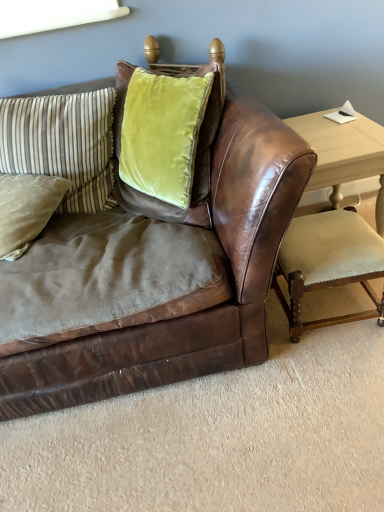
Question: Would you say velvet beige armchair at lower right is inside or outside light wood table at right?

Choices:
 (A) inside
 (B) outside

Answer: (B)

Question: Is velvet beige armchair at lower right bigger or smaller than light wood table at right?

Choices:
 (A) big
 (B) small

Answer: (B)

Question: Which of these objects is positioned farthest from the velvet green pillow at upper left, the first pillow when ordered from top to bottom?

Choices:
 (A) light wood table at right
 (B) brown leather couch at center
 (C) suede green pillow at left, which is counted as the 2th pillow, starting from the top
 (D) velvet beige armchair at lower right

Answer: (A)

Question: Based on their relative distances, which object is farther from the light wood table at right?

Choices:
 (A) suede green pillow at left, acting as the first pillow starting from the bottom
 (B) velvet beige armchair at lower right
 (C) velvet green pillow at upper left, the 2th pillow from the bottom
 (D) brown leather couch at center

Answer: (A)